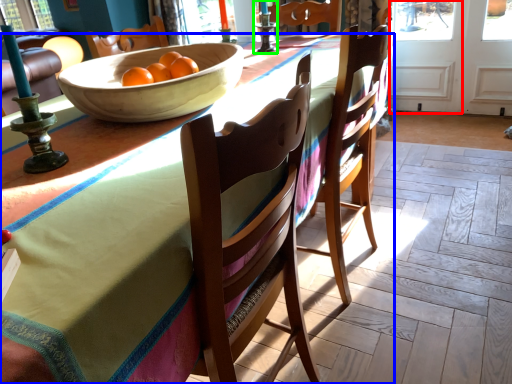
Question: Which is nearer to the screen door (highlighted by a red box)? desk (highlighted by a blue box) or candle holder (highlighted by a green box).

Choices:
 (A) desk
 (B) candle holder

Answer: (B)